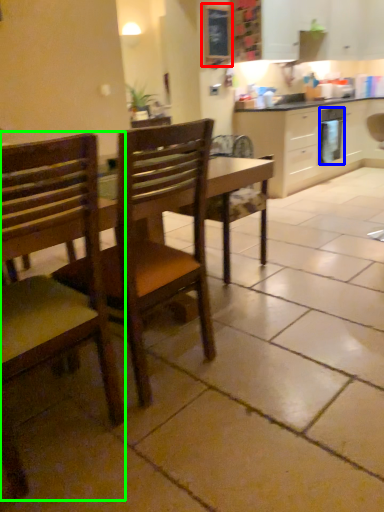
Question: Which is farther away from bulletin board (highlighted by a red box)? appliance (highlighted by a blue box) or chair (highlighted by a green box)?

Choices:
 (A) appliance
 (B) chair

Answer: (B)